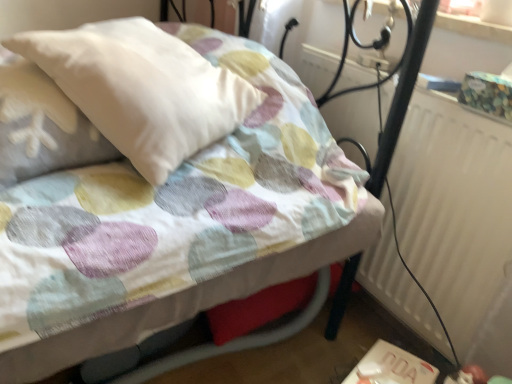
This screenshot has height=384, width=512. Describe the element at coordinates (142, 89) in the screenshot. I see `white soft pillow at upper left` at that location.

Where is `white plastic table at lower right`? The height and width of the screenshot is (384, 512). white plastic table at lower right is located at coordinates (391, 367).

Considering the sizes of objects white plastic table at lower right and white textured radiator at right in the image provided, who is wider, white plastic table at lower right or white textured radiator at right?

Wider between the two is white plastic table at lower right.

Is white plastic table at lower right far from white textured radiator at right?

No, white plastic table at lower right is not far from white textured radiator at right.

Considering the positions of point (398, 373) and point (465, 116), is point (398, 373) closer or farther from the camera than point (465, 116)?

Clearly, point (398, 373) is closer to the camera than point (465, 116).

Who is bigger, white plastic table at lower right or white textured radiator at right?

white textured radiator at right is bigger.

Between white textured radiator at right and white plastic table at lower right, which one has larger width?

white plastic table at lower right.

Considering the relative sizes of white textured radiator at right and white plastic table at lower right in the image provided, is white textured radiator at right taller than white plastic table at lower right?

Yes, white textured radiator at right is taller than white plastic table at lower right.

At what (x,y) coordinates should I click in order to perform the action: click on radiator that appears in front of the white plastic table at lower right. Please return your answer as a coordinate pair (x, y). Looking at the image, I should click on (458, 218).

Which of these two, white textured radiator at right or white plastic table at lower right, is smaller?

white plastic table at lower right.

Can you tell me how much white soft pillow at upper left and white textured radiator at right differ in facing direction?

white soft pillow at upper left and white textured radiator at right are facing 32 degrees away from each other.

Considering the positions of objects white soft pillow at upper left and white textured radiator at right in the image provided, who is more to the left, white soft pillow at upper left or white textured radiator at right?

Positioned to the left is white soft pillow at upper left.

Is white soft pillow at upper left thinner than white textured radiator at right?

In fact, white soft pillow at upper left might be wider than white textured radiator at right.

Can you confirm if white plastic table at lower right is positioned to the right of white soft pillow at upper left?

Indeed, white plastic table at lower right is positioned on the right side of white soft pillow at upper left.

Considering the sizes of white plastic table at lower right and white soft pillow at upper left in the image, is white plastic table at lower right taller or shorter than white soft pillow at upper left?

Considering their sizes, white plastic table at lower right has less height than white soft pillow at upper left.

From the picture: Which point is more forward, (426, 377) or (160, 35)?

The point (426, 377) is closer.

Could you tell me if white plastic table at lower right is facing white soft pillow at upper left?

No, white plastic table at lower right is not aimed at white soft pillow at upper left.

Is white soft pillow at upper left positioned with its back to white plastic table at lower right?

white soft pillow at upper left does not have its back to white plastic table at lower right.

Is white plastic table at lower right completely or partially inside white soft pillow at upper left?

No.

Considering the relative sizes of white soft pillow at upper left and white plastic table at lower right in the image provided, is white soft pillow at upper left taller than white plastic table at lower right?

Correct, white soft pillow at upper left is much taller as white plastic table at lower right.

In the image, is white textured radiator at right positioned in front of or behind white soft pillow at upper left?

Clearly, white textured radiator at right is behind white soft pillow at upper left.

Based on the photo, is white textured radiator at right positioned with its back to white soft pillow at upper left?

That's not correct — white textured radiator at right is not looking away from white soft pillow at upper left.

Considering the relative sizes of white textured radiator at right and white soft pillow at upper left in the image provided, is white textured radiator at right taller than white soft pillow at upper left?

Yes, white textured radiator at right is taller than white soft pillow at upper left.

Image resolution: width=512 pixels, height=384 pixels. In order to click on radiator in front of the white plastic table at lower right in this screenshot , I will do `click(458, 218)`.

Locate an element on the screen. This screenshot has height=384, width=512. radiator lying on the right of white plastic table at lower right is located at coordinates (458, 218).

Based on the photo, looking at the image, which one is located closer to white soft pillow at upper left, white textured radiator at right or white plastic table at lower right?

Based on the image, white textured radiator at right appears to be nearer to white soft pillow at upper left.

Looking at the image, which one is located further to white plastic table at lower right, white textured radiator at right or white soft pillow at upper left?

white soft pillow at upper left is positioned further to the anchor white plastic table at lower right.

When comparing their distances from white textured radiator at right, does white plastic table at lower right or white soft pillow at upper left seem closer?

white plastic table at lower right is positioned closer to the anchor white textured radiator at right.

When comparing their distances from white plastic table at lower right, does white soft pillow at upper left or white textured radiator at right seem further?

The object further to white plastic table at lower right is white soft pillow at upper left.

Considering their positions, is white plastic table at lower right positioned further to white soft pillow at upper left than white textured radiator at right?

white plastic table at lower right is positioned further to the anchor white soft pillow at upper left.

Which object lies further to the anchor point white textured radiator at right, white soft pillow at upper left or white plastic table at lower right?

The object further to white textured radiator at right is white soft pillow at upper left.

Where is `radiator between white soft pillow at upper left and white plastic table at lower right from top to bottom`? The width and height of the screenshot is (512, 384). radiator between white soft pillow at upper left and white plastic table at lower right from top to bottom is located at coordinates (458, 218).